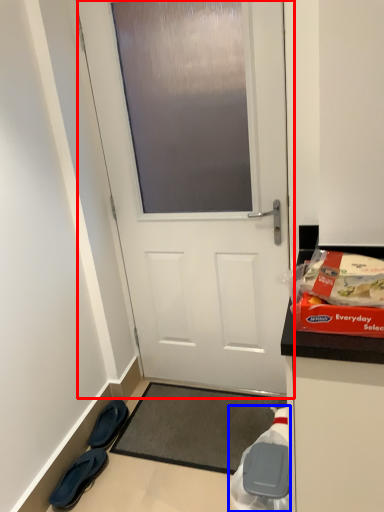
Question: Which point is further to the camera, door (highlighted by a red box) or waste (highlighted by a blue box)?

Choices:
 (A) door
 (B) waste

Answer: (A)